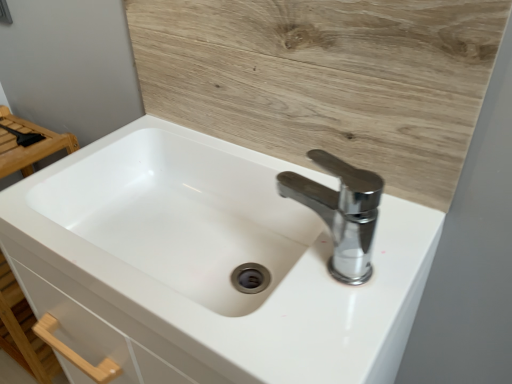
In order to click on vacant region in front of chrome metallic faucet at upper right in this screenshot , I will do `click(317, 319)`.